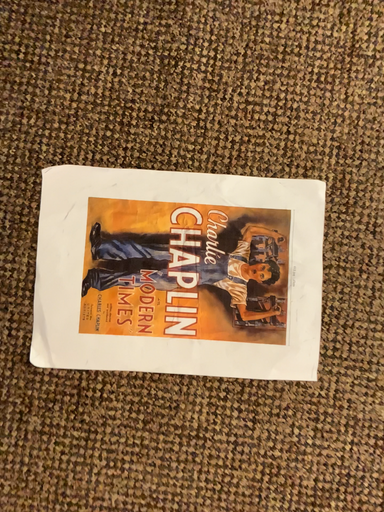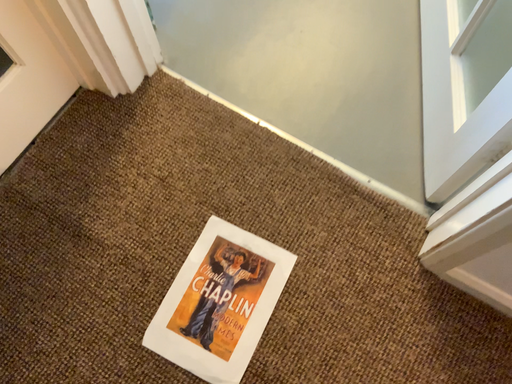
Question: Which way did the camera rotate in the video?

Choices:
 (A) rotated upward
 (B) rotated downward

Answer: (A)